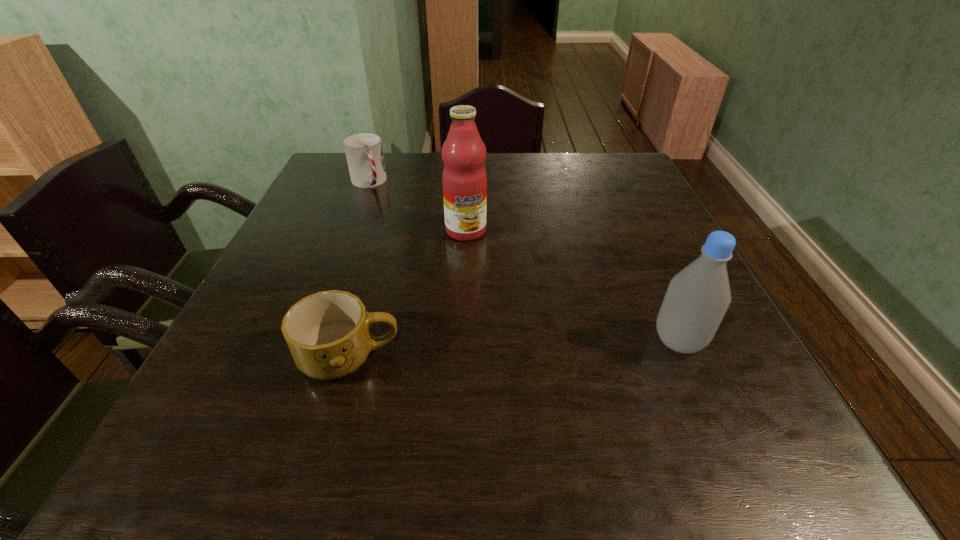
Where is `mug`? mug is located at coordinates (328, 333).

Find the location of a particular element. The width and height of the screenshot is (960, 540). bottle is located at coordinates (697, 298).

Where is `the rightmost object`? This screenshot has height=540, width=960. the rightmost object is located at coordinates (697, 298).

The height and width of the screenshot is (540, 960). I want to click on cup, so click(364, 153).

Where is `the third nearest object`? The height and width of the screenshot is (540, 960). the third nearest object is located at coordinates (464, 179).

This screenshot has width=960, height=540. Identify the location of fruit juice. (464, 179).

Locate an element on the screen. Image resolution: width=960 pixels, height=540 pixels. blank space located 0.190m on the side with the handle of the mug is located at coordinates (506, 357).

Identify the location of free region located 0.140m on the back of the rightmost object. (650, 275).

This screenshot has width=960, height=540. I want to click on free space located 0.350m on the side of the farthest object where the handle is located, so click(416, 265).

The width and height of the screenshot is (960, 540). I want to click on blank space located 0.170m on the side of the farthest object where the handle is located, so click(391, 224).